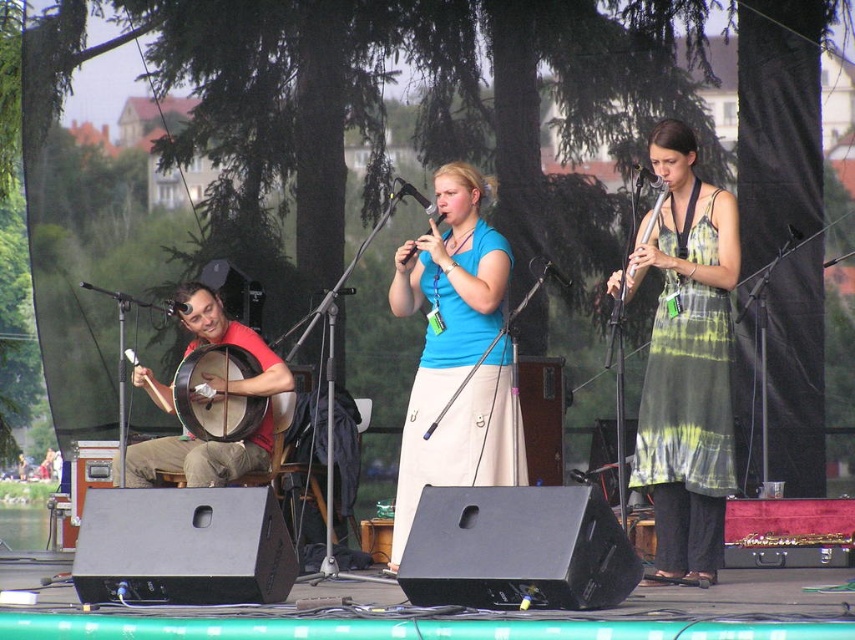
You are standing at the center of the stage and want to move towards the musician on the left. Which direction should you go first? The two points you see are point A at coordinates point A is point (428, 380) and point B is point (131, 380). Which point should you move towards first?

You should move towards point A at coordinates point A is point (428, 380) first because it is closer to the camera than point B at coordinates point B is point (131, 380).

You are a stagehand setting up a music stand for the performers. The stand can only hold one instrument at a time. Which instrument, the matte red banjo at left or the matte blue flute at center, should you place the stand closer to based on their sizes?

The matte red banjo at left is larger in size than the matte blue flute at center, so you should place the music stand closer to the matte red banjo at left to accommodate its size.